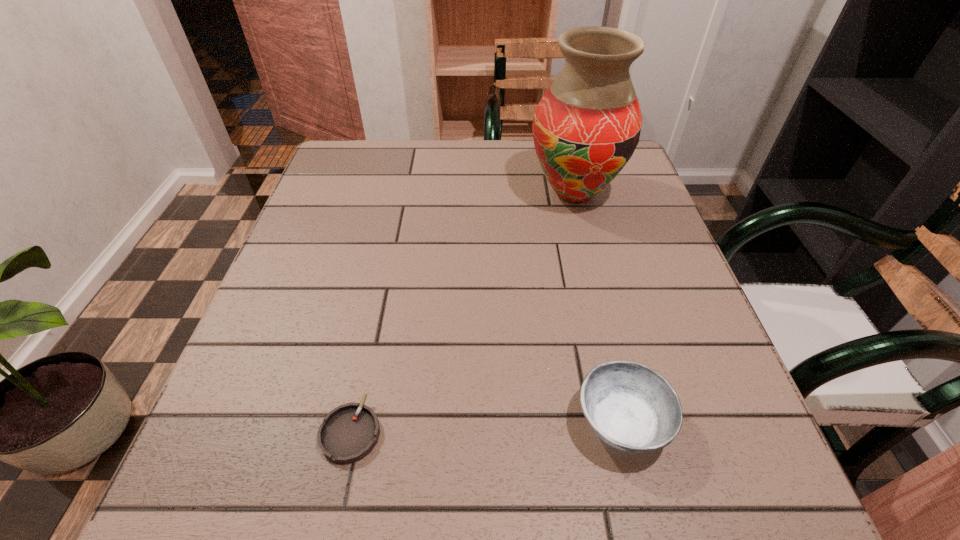
This screenshot has width=960, height=540. Identify the location of the tallest object. (586, 127).

At what (x,y) coordinates should I click in order to perform the action: click on vase. Please return your answer as a coordinate pair (x, y). The image size is (960, 540). Looking at the image, I should click on (586, 127).

Where is `the taller ashtray`? This screenshot has height=540, width=960. the taller ashtray is located at coordinates (632, 408).

This screenshot has height=540, width=960. I want to click on the second shortest object, so click(x=632, y=408).

The image size is (960, 540). I want to click on the shorter ashtray, so 348,433.

Where is `the shortest object`? The height and width of the screenshot is (540, 960). the shortest object is located at coordinates (348, 433).

The image size is (960, 540). I want to click on vacant region located 0.310m on the left of the tallest object, so click(x=399, y=193).

I want to click on blank space located 0.120m on the left of the second shortest object, so click(494, 422).

At what (x,y) coordinates should I click in order to perform the action: click on free space located 0.400m on the back of the left ashtray. Please return your answer as a coordinate pair (x, y). The image size is (960, 540). Looking at the image, I should click on (393, 233).

Image resolution: width=960 pixels, height=540 pixels. I want to click on object positioned at the far edge, so click(586, 127).